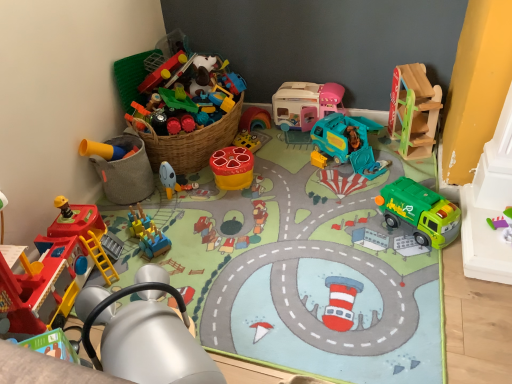
Where is `vacant space in between yellow matte bucket at lower left, the 9th toy when ordered from right to left, and blue plastic train at center, acting as the 8th toy starting from the right`? vacant space in between yellow matte bucket at lower left, the 9th toy when ordered from right to left, and blue plastic train at center, acting as the 8th toy starting from the right is located at coordinates 149,214.